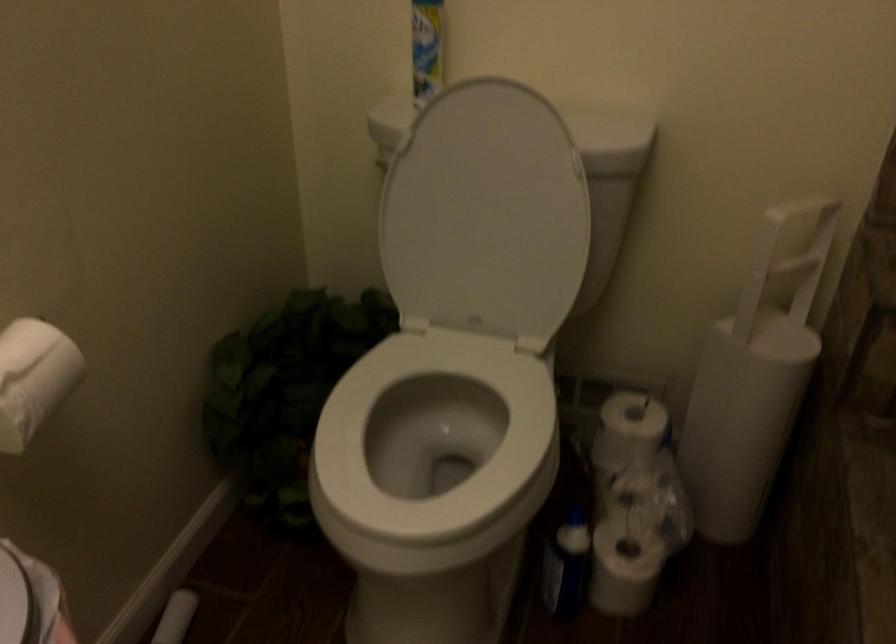
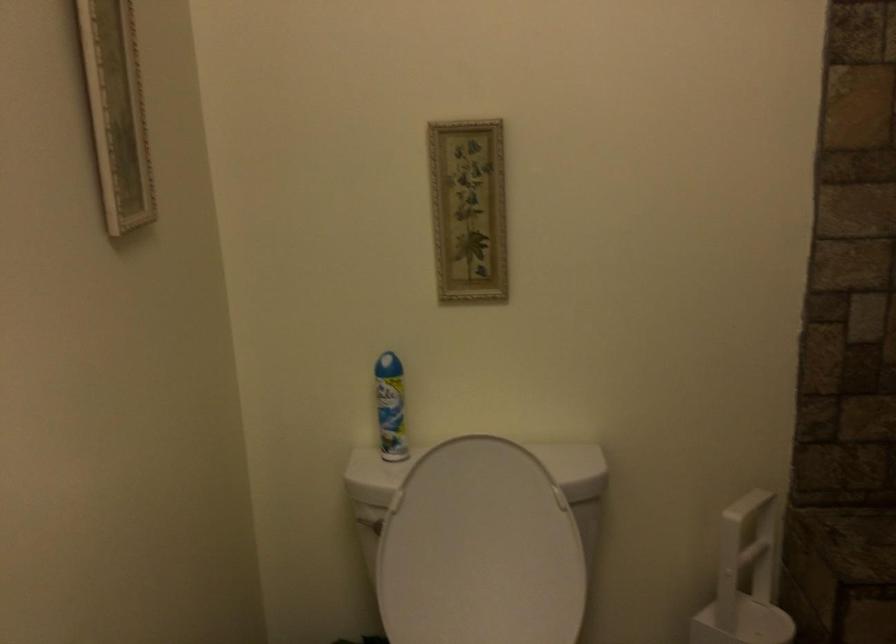
The point at (487, 212) is marked in the first image. Where is the corresponding point in the second image?

(479, 550)